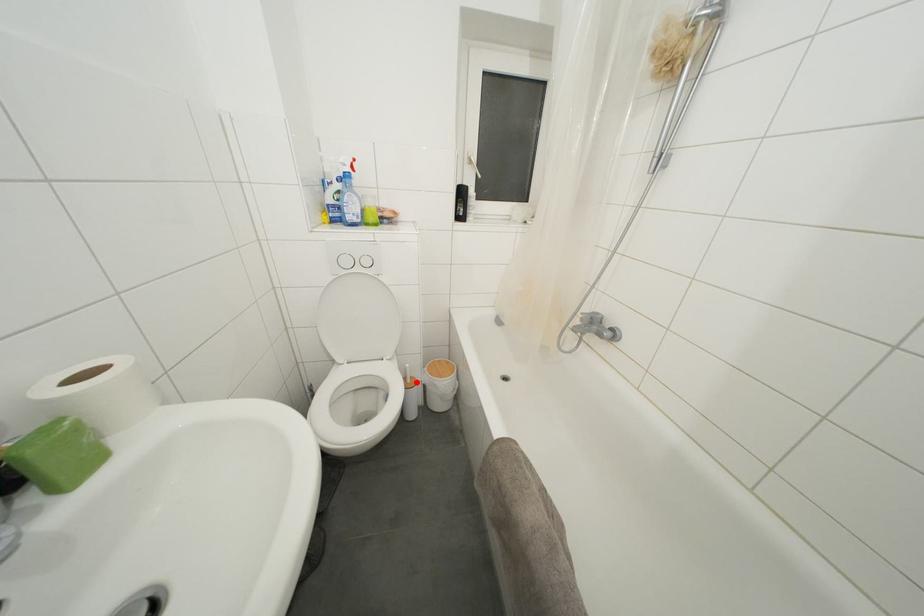
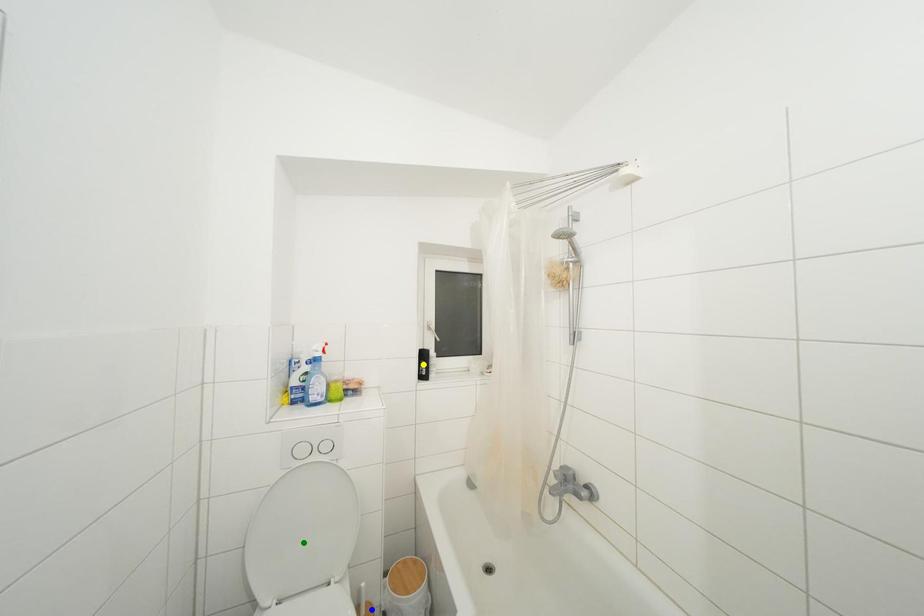
Question: I am providing you with two images of the same scene from different viewpoints. A red point is marked on the first image. You are given multiple points on the second image. Which spot in image 2 lines up with the point in image 1?

Choices:
 (A) blue point
 (B) green point
 (C) yellow point

Answer: (A)